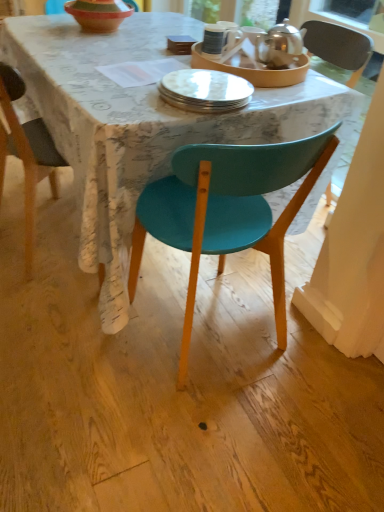
This screenshot has height=512, width=384. Identify the location of vacant space to the left of white glossy plate at center. (109, 99).